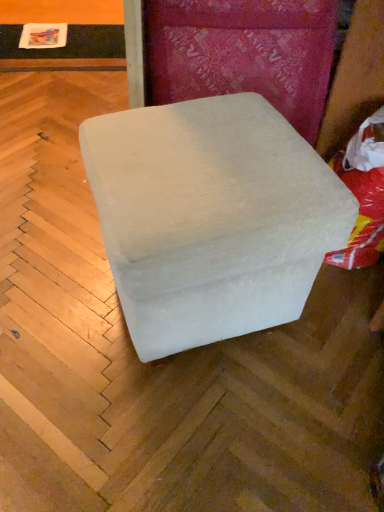
At what (x,y) coordinates should I click in order to perform the action: click on vacant point above white fabric ottoman at center (from a real-world perspective). Please return your answer as a coordinate pair (x, y). The height and width of the screenshot is (512, 384). Looking at the image, I should click on (204, 151).